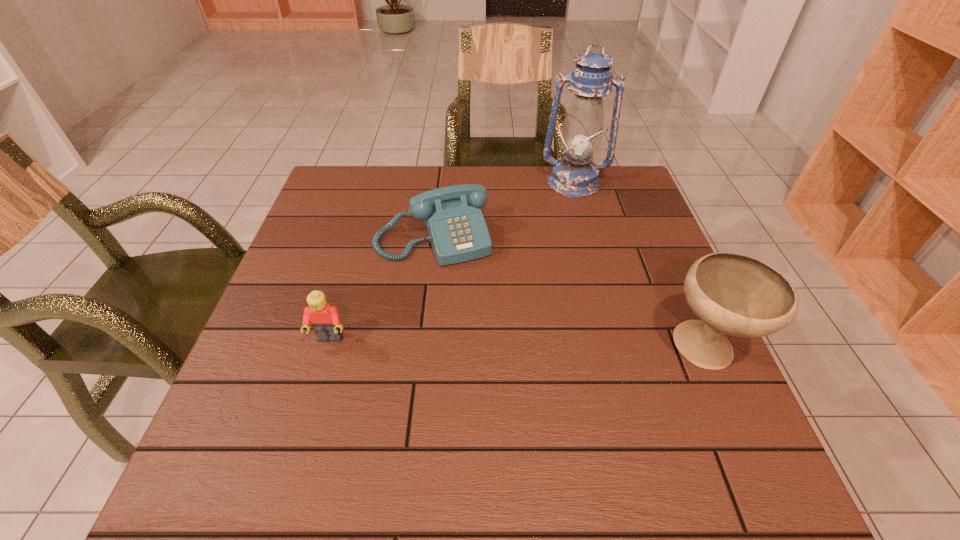
Identify the location of free spot on the desktop that is between the Lego and the second tallest object and is positioned on the dial of the third nearest object. Image resolution: width=960 pixels, height=540 pixels. (474, 343).

At what (x,y) coordinates should I click in order to perform the action: click on vacant space on the desktop that is between the Lego and the second tallest object and is positioned on the front-facing side of the lantern. Please return your answer as a coordinate pair (x, y). Image resolution: width=960 pixels, height=540 pixels. Looking at the image, I should click on (568, 346).